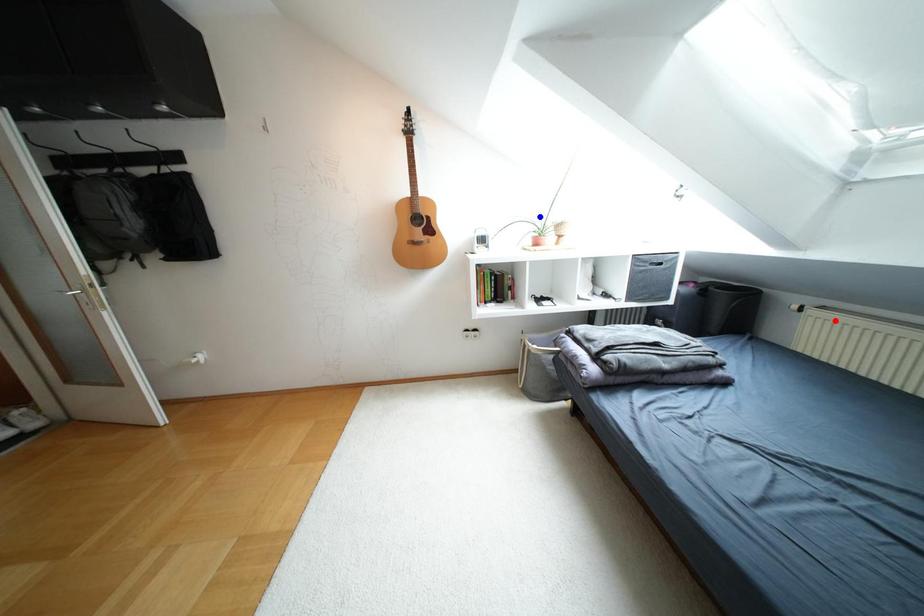
Question: In the image, two points are highlighted. Which point is nearer to the camera? Reply with the corresponding letter.

Choices:
 (A) blue point
 (B) red point

Answer: (B)